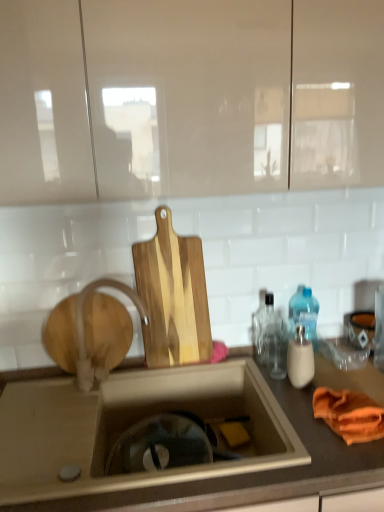
Locate an element on the screen. The width and height of the screenshot is (384, 512). unoccupied area in front of translucent plastic bottle at right, which ranks as the third bottle in front-to-back order is located at coordinates (334, 379).